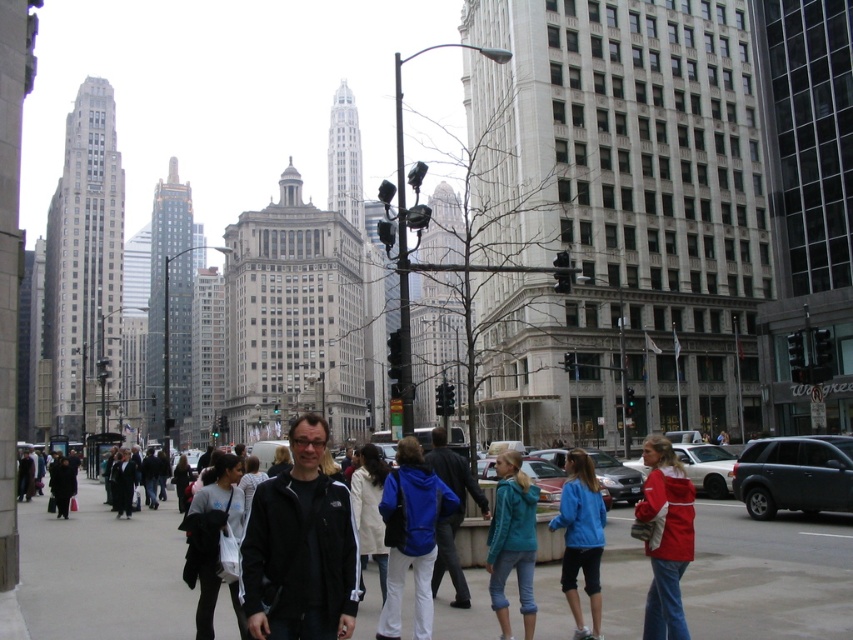
Question: Which object is closer to the camera taking this photo?

Choices:
 (A) red jacket at right
 (B) black jacket at center
 (C) gray concrete sidewalk at center
 (D) blue fleece jacket at center

Answer: (A)

Question: Is gray concrete sidewalk at center to the right of black plastic pole at center from the viewer's perspective?

Choices:
 (A) yes
 (B) no

Answer: (A)

Question: Is black matte jacket at center to the right of blue fleece jacket at center from the viewer's perspective?

Choices:
 (A) yes
 (B) no

Answer: (B)

Question: Which point is farther to the camera?

Choices:
 (A) (660, 483)
 (B) (456, 548)

Answer: (B)

Question: Which point is closer to the camera?

Choices:
 (A) blue fleece jacket at center
 (B) gray concrete sidewalk at center

Answer: (B)

Question: Is gray concrete sidewalk at center smaller than metallic gray building at center?

Choices:
 (A) no
 (B) yes

Answer: (B)